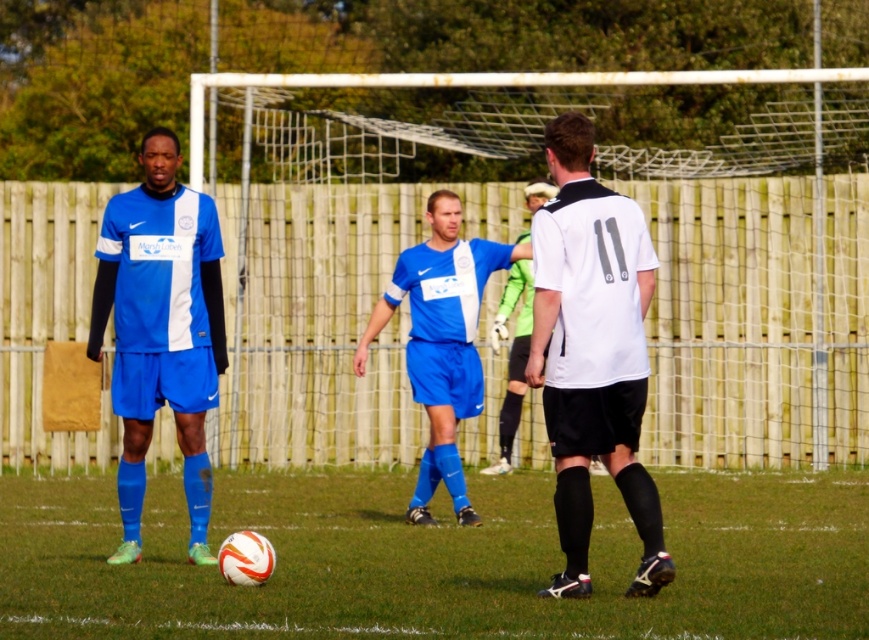
You are a referee in the soccer match and need to determine if the white matte jersey at center is closer to the ball than the matte blue jersey at left. Can you confirm this?

Answer: The white matte jersey at center is in front of the matte blue jersey at left, so yes, the white matte jersey at center is closer to the ball than the matte blue jersey at left.

You are a soccer coach analyzing the field position. You notice the white matte soccer ball at center and the blue jersey at center. Based on their positions, which object is closer to the left edge of the field?

The white matte soccer ball at center is closer to the left edge of the field because it is positioned to the left of the blue jersey at center.

You are a soccer coach analyzing the field layout. You notice the white matte jersey at center and the matte blue jersey at left. Which player has a narrower torso? Please base your answer on the visual cues from the image.

The white matte jersey at center has a lesser width compared to the matte blue jersey at left, indicating that the player in the white matte jersey at center has a narrower torso.